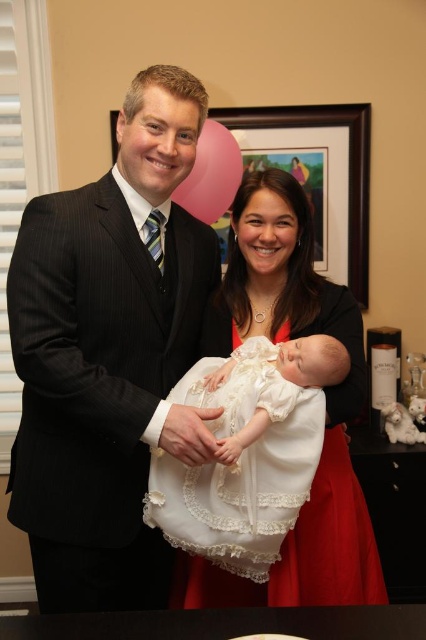
You are a photographer setting up for a family photo shoot. You notice the matte white dress at center and the white lace dress at center. Which dress is wider?

The matte white dress at center is wider than the white lace dress at center.

From the picture: Based on the scene description, what are the coordinates of the black pinstripe suit at left?

The black pinstripe suit at left is located at coordinates (x=109, y=355).

You are standing in the room and need to locate the black pinstripe suit at left. According to the coordinates provided, where would you find it?

The black pinstripe suit at left is located at coordinates point (109, 355).